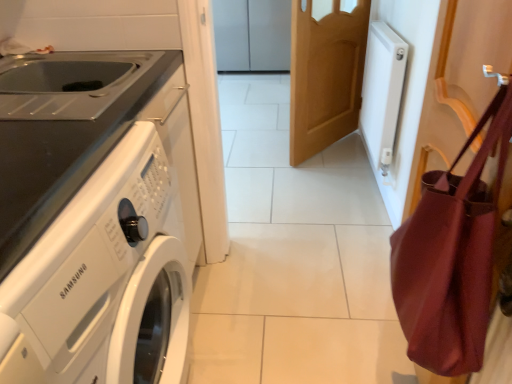
Question: From a real-world perspective, is white glossy washing machine at left positioned over metallic stainless steel sink at left based on gravity?

Choices:
 (A) no
 (B) yes

Answer: (A)

Question: Considering the relative sizes of white glossy washing machine at left and metallic stainless steel sink at left in the image provided, is white glossy washing machine at left bigger than metallic stainless steel sink at left?

Choices:
 (A) yes
 (B) no

Answer: (A)

Question: From a real-world perspective, does white glossy washing machine at left sit lower than metallic stainless steel sink at left?

Choices:
 (A) yes
 (B) no

Answer: (A)

Question: Considering the relative positions of white glossy washing machine at left and metallic stainless steel sink at left in the image provided, is white glossy washing machine at left to the left of metallic stainless steel sink at left from the viewer's perspective?

Choices:
 (A) yes
 (B) no

Answer: (B)

Question: Can you confirm if white glossy washing machine at left is wider than metallic stainless steel sink at left?

Choices:
 (A) yes
 (B) no

Answer: (A)

Question: From the image's perspective, relative to matte burgundy shoulder bag at right, is white glossy cabinet at upper center above or below?

Choices:
 (A) above
 (B) below

Answer: (A)

Question: From their relative heights in the image, would you say white glossy cabinet at upper center is taller or shorter than matte burgundy shoulder bag at right?

Choices:
 (A) tall
 (B) short

Answer: (A)

Question: Looking at the image, does white glossy cabinet at upper center seem bigger or smaller compared to matte burgundy shoulder bag at right?

Choices:
 (A) small
 (B) big

Answer: (B)

Question: From a real-world perspective, is white glossy cabinet at upper center positioned above or below matte burgundy shoulder bag at right?

Choices:
 (A) below
 (B) above

Answer: (A)

Question: Visually, is white glossy cabinet at upper center positioned to the left or to the right of white glossy washing machine at left?

Choices:
 (A) right
 (B) left

Answer: (A)

Question: Is white glossy cabinet at upper center wider or thinner than white glossy washing machine at left?

Choices:
 (A) thin
 (B) wide

Answer: (A)

Question: From the image's perspective, is white glossy cabinet at upper center located above or below white glossy washing machine at left?

Choices:
 (A) above
 (B) below

Answer: (A)

Question: Is point (216, 51) closer or farther from the camera than point (133, 370)?

Choices:
 (A) farther
 (B) closer

Answer: (A)

Question: Is point (98, 97) closer or farther from the camera than point (228, 52)?

Choices:
 (A) farther
 (B) closer

Answer: (B)

Question: In the image, is metallic stainless steel sink at left positioned in front of or behind white glossy cabinet at upper center?

Choices:
 (A) behind
 (B) front

Answer: (B)